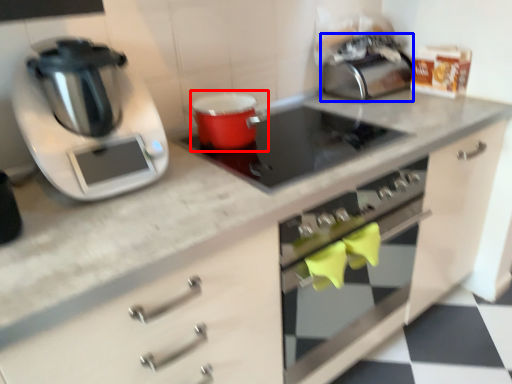
Question: Which object is closer to the camera taking this photo, appliance (highlighted by a red box) or toaster (highlighted by a blue box)?

Choices:
 (A) appliance
 (B) toaster

Answer: (A)